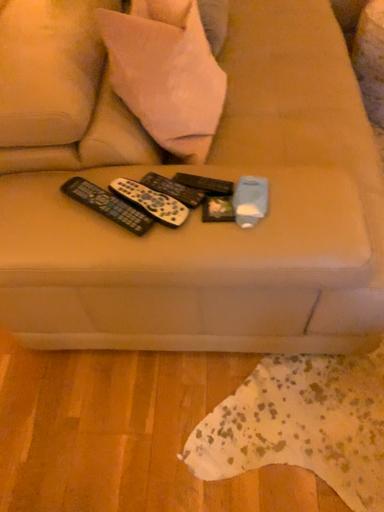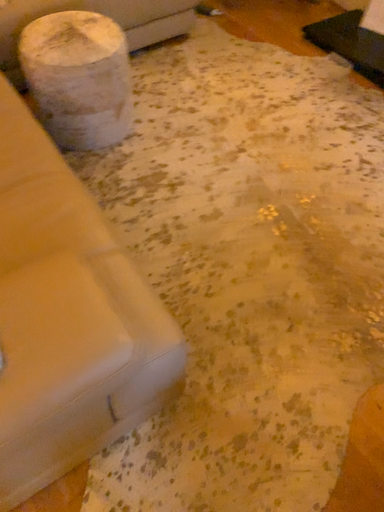
Question: Which way did the camera rotate in the video?

Choices:
 (A) rotated left
 (B) rotated right

Answer: (B)